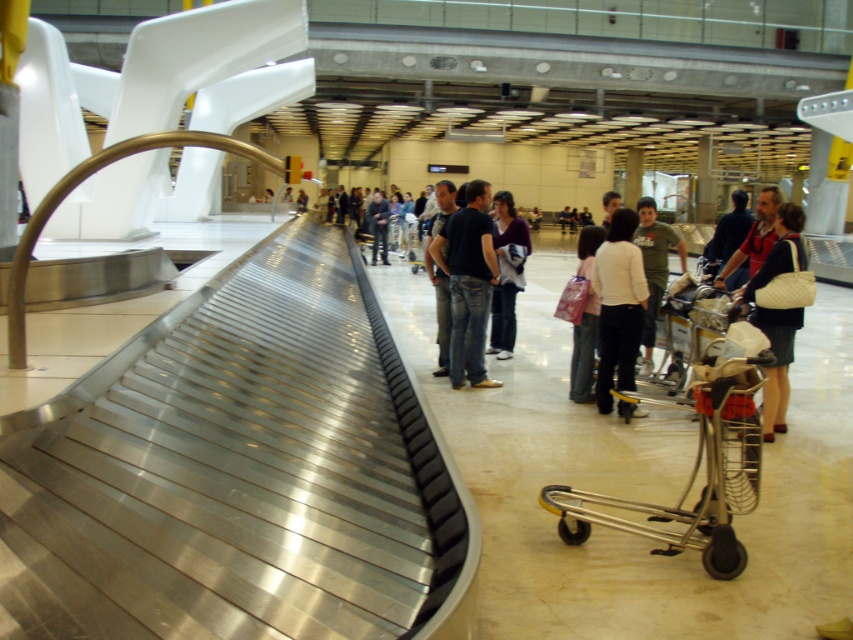
You are an airport staff member who needs to retrieve a lost item. You see the jeans at center and the matte purple shirt at center. Which item is closer to you?

The jeans at center is in front of the matte purple shirt at center, so the jeans at center is closer to you.

You are a traveler standing in the baggage claim area and notice a person wearing the white matte sweater at center and dark blue jeans at center. Based on their clothing, can you determine if the sweater is above or below the jeans?

The white matte sweater at center is positioned under the dark blue jeans at center, so the sweater is below the jeans.

You are a traveler standing at the baggage claim area and you see a white matte sweater at center and a dark blue jeans at center. Which item is positioned more to the right side?

The white matte sweater at center is positioned to the right of the dark blue jeans at center, so the white matte sweater at center is more to the right side.